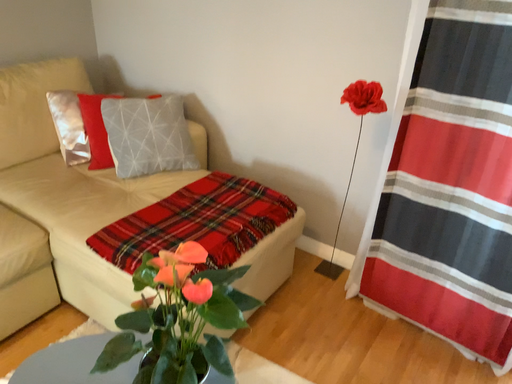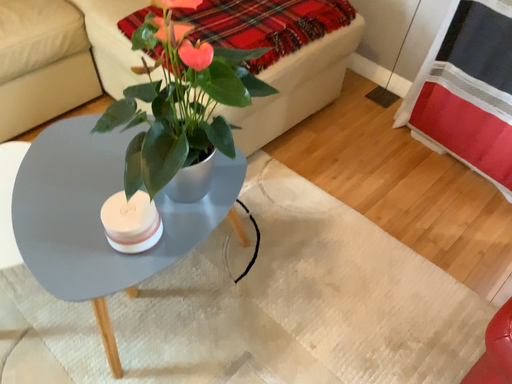
Question: How did the camera likely rotate when shooting the video?

Choices:
 (A) rotated downward
 (B) rotated upward

Answer: (A)